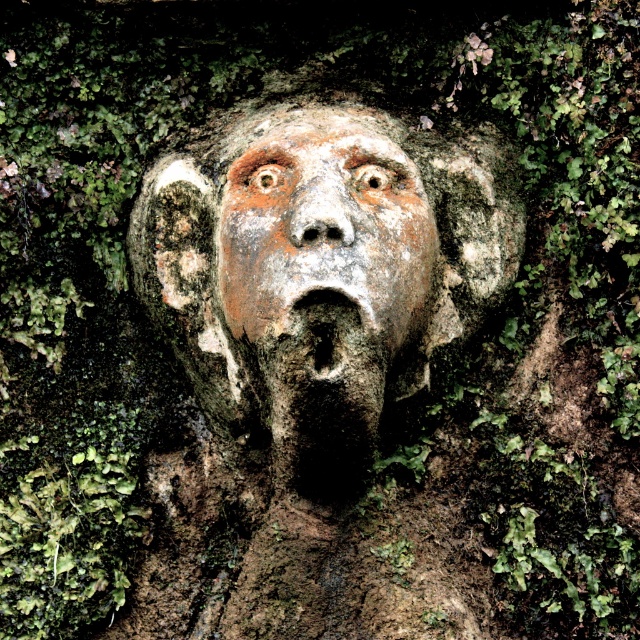
Is point (285, 349) less distant than point (348, 264)?

No, it is not.

Does weathered stone face at center have a lesser width compared to rusty stone face at center?

Incorrect, weathered stone face at center's width is not less than rusty stone face at center's.

Is point (481, 163) farther from viewer compared to point (381, 316)?

Yes, point (481, 163) is behind point (381, 316).

Where is `weathered stone face at center`? This screenshot has height=640, width=640. weathered stone face at center is located at coordinates coord(317,268).